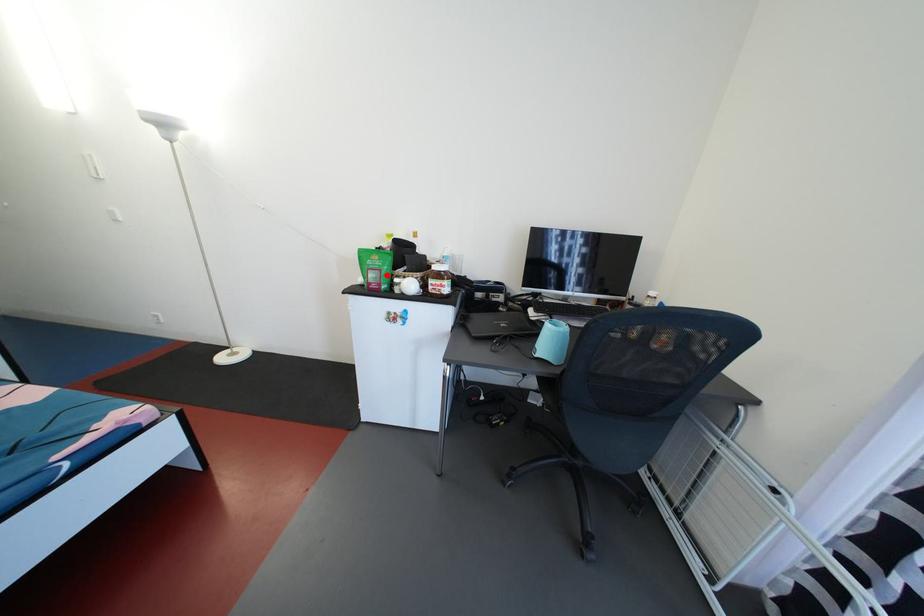
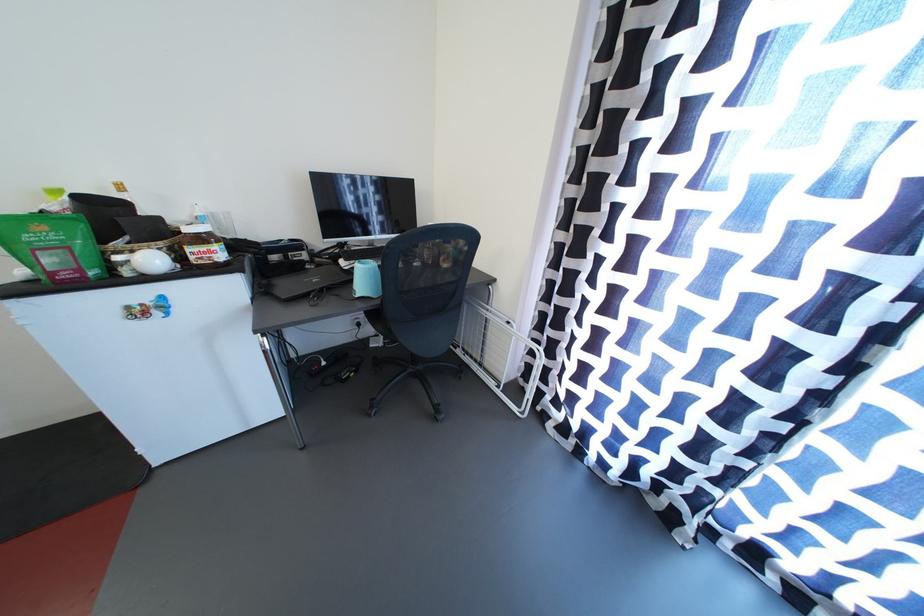
Question: I am providing you with two images of the same scene from different viewpoints. A red point is marked on the first image. Can you still see the location of the red point in image 2?

Choices:
 (A) Yes
 (B) No

Answer: (A)